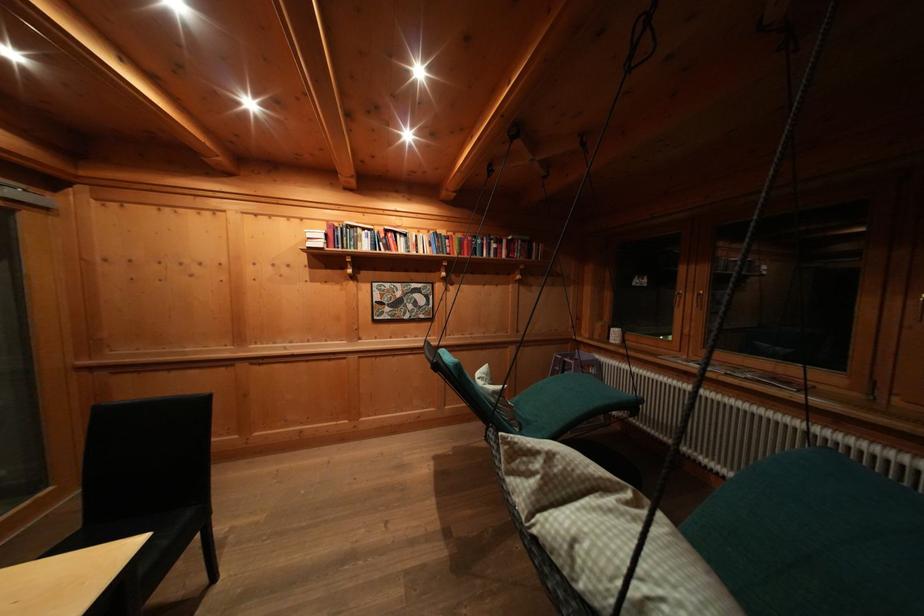
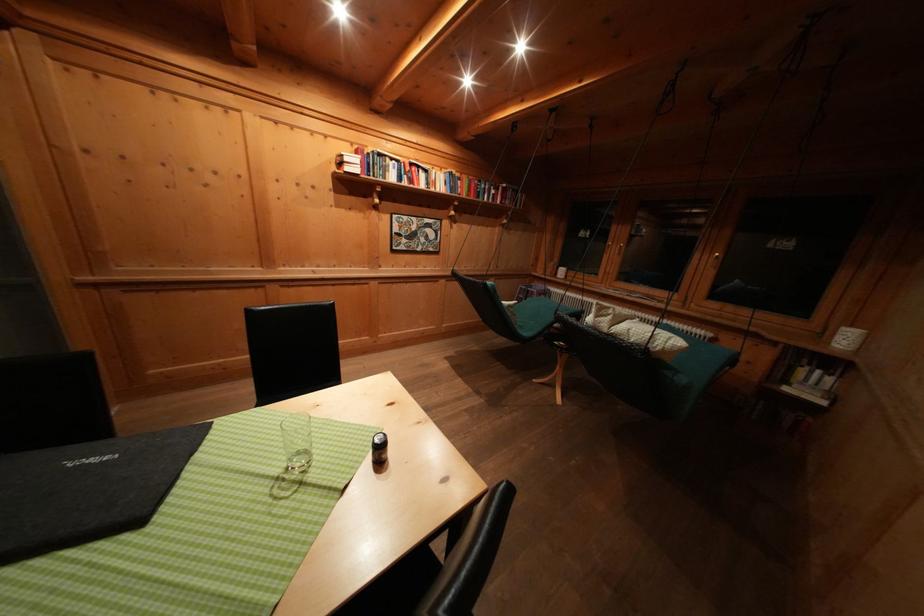
Locate, in the second image, the point that corresponds to pixel 393 236 in the first image.

(418, 169)